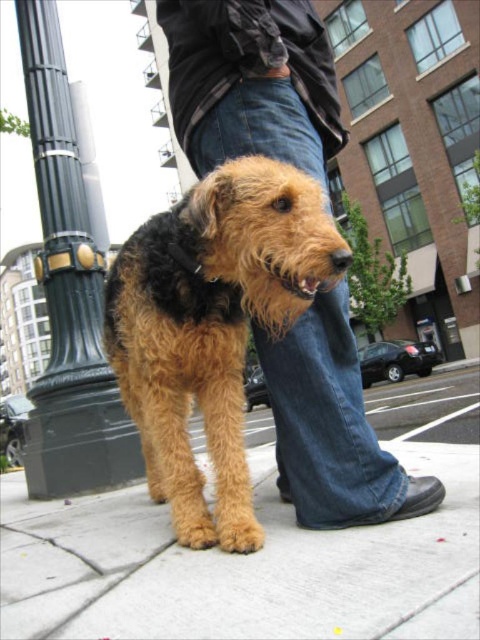
Based on the photo, you are a photographer trying to capture a photo of the fuzzy brown dog at center and the jeans at center. If you want to focus on the taller subject, which one should you adjust your camera to focus on?

The fuzzy brown dog at center is much taller than the jeans at center, so you should adjust your camera to focus on the fuzzy brown dog at center.